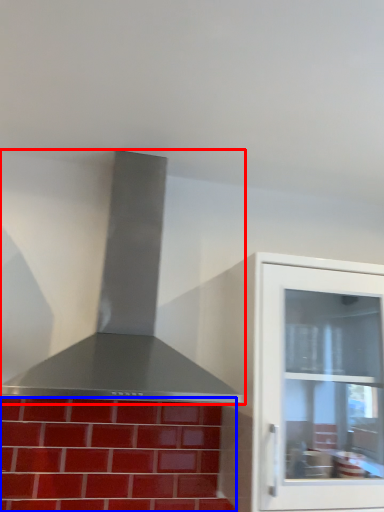
Question: Which object is further to the camera taking this photo, vent (highlighted by a red box) or brickwork (highlighted by a blue box)?

Choices:
 (A) vent
 (B) brickwork

Answer: (B)